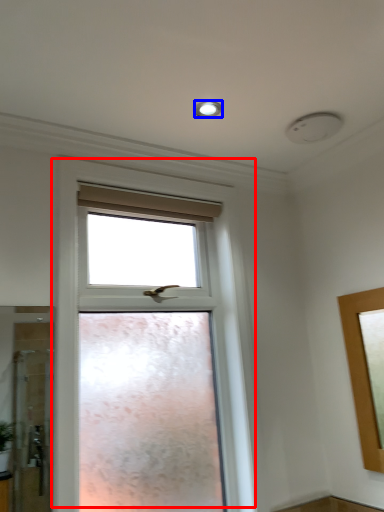
Question: Which of the following is the farthest to the observer, window (highlighted by a red box) or lighting (highlighted by a blue box)?

Choices:
 (A) window
 (B) lighting

Answer: (B)